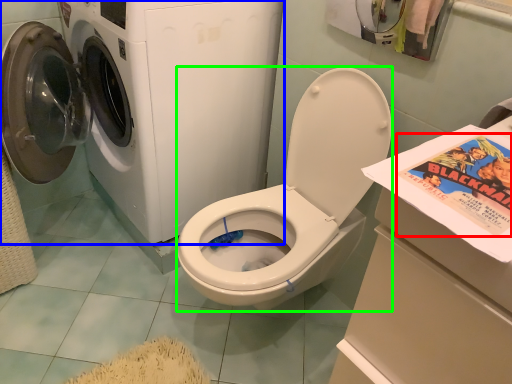
Question: Based on their relative distances, which object is farther from comic book (highlighted by a red box)? Choose from washing machine (highlighted by a blue box) and washer (highlighted by a green box).

Choices:
 (A) washing machine
 (B) washer

Answer: (A)